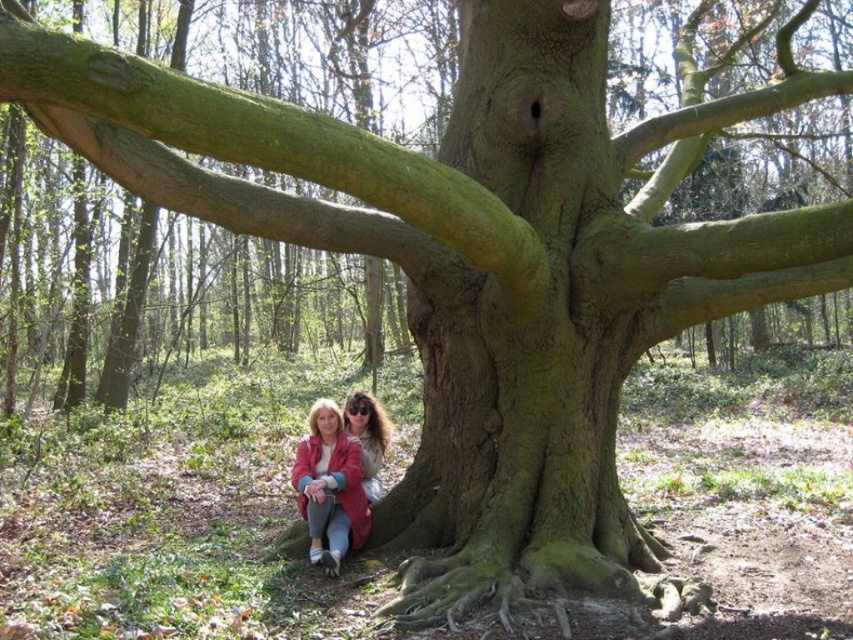
Question: Can you confirm if matte pink coat at lower center is smaller than matte pink jacket at lower center?

Choices:
 (A) yes
 (B) no

Answer: (B)

Question: Which of the following is the closest to the observer?

Choices:
 (A) (292, 486)
 (B) (370, 461)

Answer: (B)

Question: Which point is farther to the camera?

Choices:
 (A) matte pink coat at lower center
 (B) matte pink jacket at lower center

Answer: (B)

Question: Can you confirm if matte pink coat at lower center is positioned below matte pink jacket at lower center?

Choices:
 (A) yes
 (B) no

Answer: (A)

Question: Is the position of matte pink coat at lower center less distant than that of matte pink jacket at lower center?

Choices:
 (A) yes
 (B) no

Answer: (A)

Question: Which object is closer to the camera taking this photo?

Choices:
 (A) matte pink jacket at lower center
 (B) matte pink coat at lower center

Answer: (B)